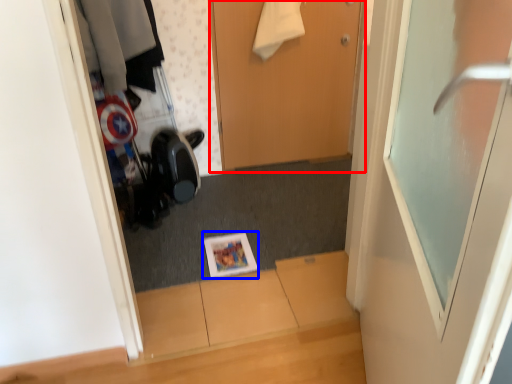
Question: Which object is closer to the camera taking this photo, door (highlighted by a red box) or magazine (highlighted by a blue box)?

Choices:
 (A) door
 (B) magazine

Answer: (B)